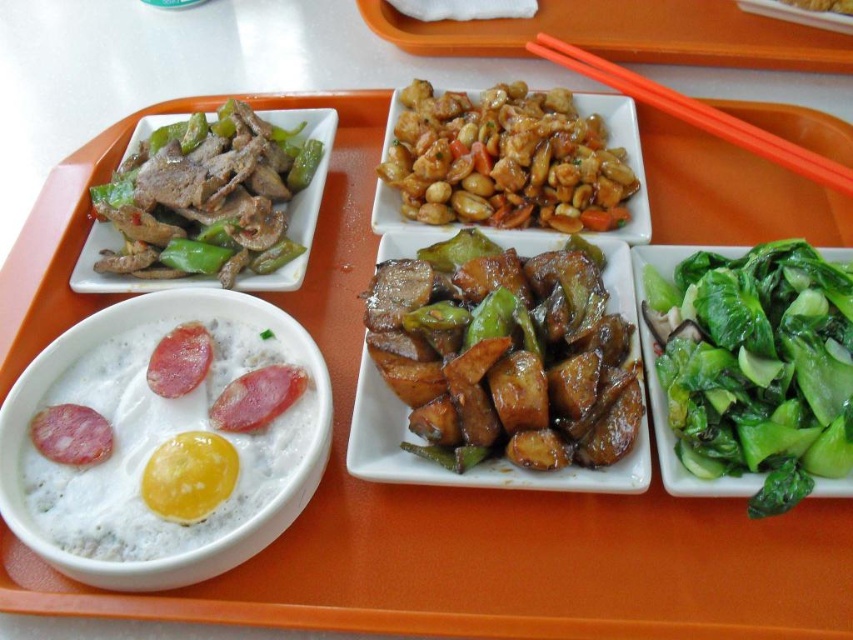
You are looking at the meal on the orange cafeteria tray. There are two points marked on the tray. The first point is at coordinates point (579, 220) and the second is at point (282, 481). From your perspective, which point is closer to you?

Point (579, 220) is behind point (282, 481), so the point closer to you is point (282, 481).